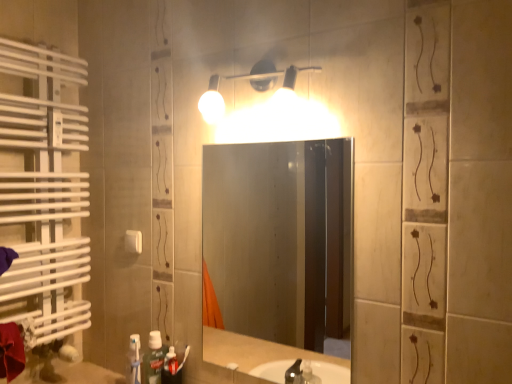
Question: Could you tell me if white plastic light switch at upper center is facing green matte toothpaste at lower left?

Choices:
 (A) yes
 (B) no

Answer: (B)

Question: From a real-world perspective, is white plastic light switch at upper center over green matte toothpaste at lower left?

Choices:
 (A) yes
 (B) no

Answer: (A)

Question: Can you confirm if white plastic light switch at upper center is taller than green matte toothpaste at lower left?

Choices:
 (A) no
 (B) yes

Answer: (A)

Question: Does white plastic light switch at upper center have a lesser width compared to green matte toothpaste at lower left?

Choices:
 (A) yes
 (B) no

Answer: (A)

Question: Would you consider white plastic light switch at upper center to be distant from green matte toothpaste at lower left?

Choices:
 (A) yes
 (B) no

Answer: (B)

Question: From a real-world perspective, does white plastic light switch at upper center sit lower than green matte toothpaste at lower left?

Choices:
 (A) yes
 (B) no

Answer: (B)

Question: Is green matte toothpaste at lower left thinner than white plastic light switch at upper center?

Choices:
 (A) no
 (B) yes

Answer: (A)

Question: Is white plastic light switch at upper center inside green matte toothpaste at lower left?

Choices:
 (A) no
 (B) yes

Answer: (A)

Question: Is green matte toothpaste at lower left closer to the viewer compared to white plastic light switch at upper center?

Choices:
 (A) yes
 (B) no

Answer: (A)

Question: Is green matte toothpaste at lower left at the left side of white plastic light switch at upper center?

Choices:
 (A) yes
 (B) no

Answer: (B)

Question: From the image's perspective, does green matte toothpaste at lower left appear higher than white plastic light switch at upper center?

Choices:
 (A) no
 (B) yes

Answer: (A)

Question: Is green matte toothpaste at lower left smaller than white plastic light switch at upper center?

Choices:
 (A) no
 (B) yes

Answer: (A)

Question: Is the position of white plastic light switch at upper center more distant than that of matte white light fixture at upper center?

Choices:
 (A) yes
 (B) no

Answer: (A)